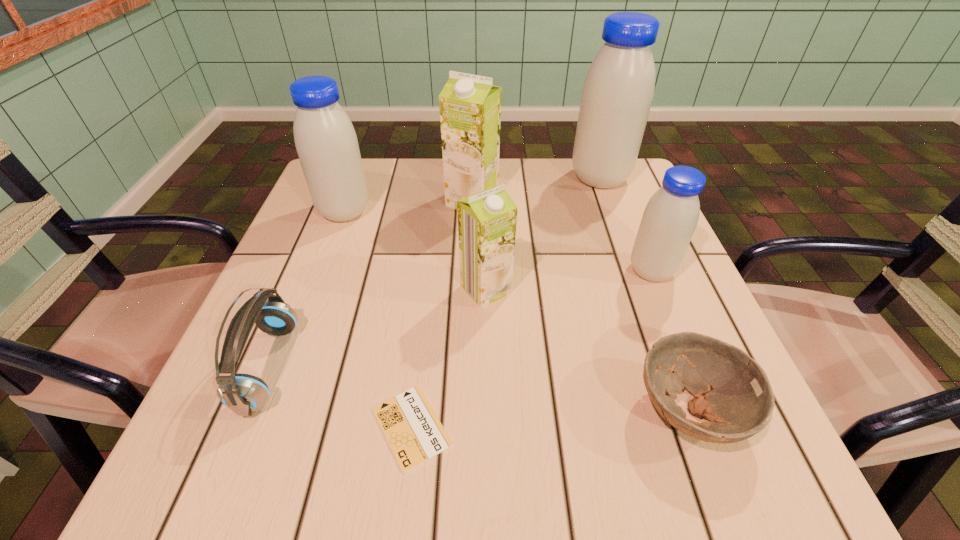
The image size is (960, 540). What are the coordinates of `bowl` in the screenshot? It's located at (732, 391).

I want to click on the shortest object, so click(415, 434).

At what (x,y) coordinates should I click in order to perform the action: click on vacant space situated 0.120m on the front of the tallest object. Please return your answer as a coordinate pair (x, y). The width and height of the screenshot is (960, 540). Looking at the image, I should click on (616, 225).

The height and width of the screenshot is (540, 960). I want to click on free location located 0.210m on the left of the bigger green soya milk, so click(x=360, y=201).

This screenshot has width=960, height=540. I want to click on free space located on the right of the leftmost blue soya milk, so click(x=409, y=212).

You are a GUI agent. You are given a task and a screenshot of the screen. Output one action in this format:
    pyautogui.click(x=<x>, y=<y>)
    Task: Click on the vacant space located on the front of the smaller green soya milk
    The height and width of the screenshot is (540, 960).
    Given the screenshot: What is the action you would take?
    pyautogui.click(x=488, y=399)

The height and width of the screenshot is (540, 960). What are the coordinates of `vacant point located on the left of the nearest blue soya milk` in the screenshot? It's located at [441, 271].

What are the coordinates of `vacant position located 0.070m on the ear cups of the headset` in the screenshot? It's located at (332, 367).

The height and width of the screenshot is (540, 960). Identify the location of blank space located 0.350m on the back of the brown bowl. (623, 232).

Find the location of `vacant space located 0.320m on the back of the shortest object`. vacant space located 0.320m on the back of the shortest object is located at coordinates (432, 255).